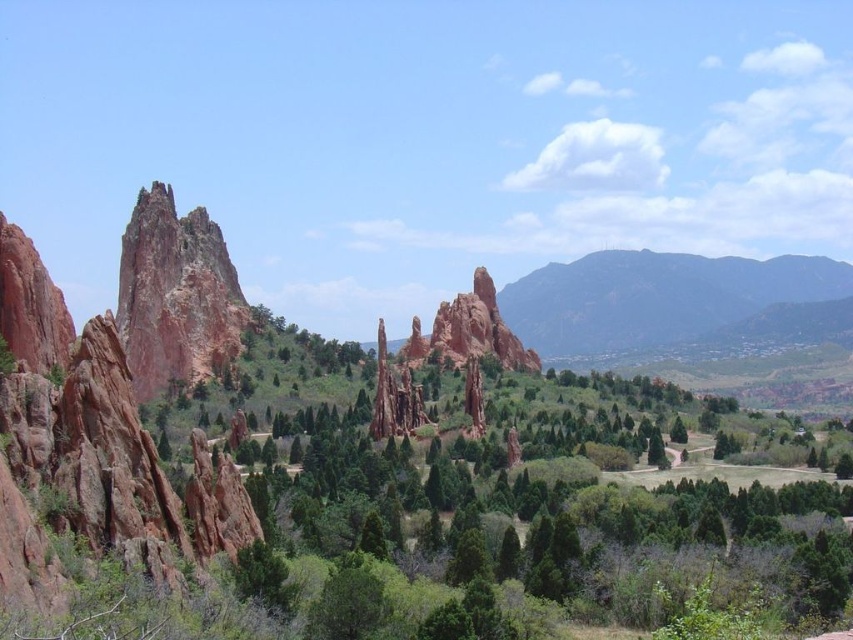
Describe the element at coordinates (654, 298) in the screenshot. I see `dark gray rocky mountain at right` at that location.

Does point (715, 260) come in front of point (408, 378)?

No, (715, 260) is further to viewer.

This screenshot has width=853, height=640. In order to click on dark gray rocky mountain at right in this screenshot , I will do `click(654, 298)`.